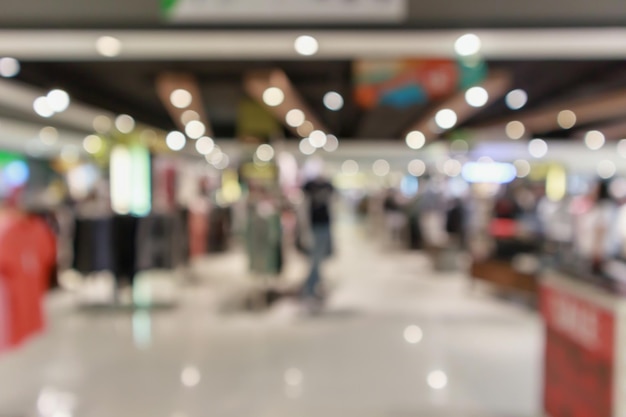
You are a GUI agent. You are given a task and a screenshot of the screen. Output one action in this format:
    pyautogui.click(x=<x>, y=<y>)
    Task: Click on the mannequin
    
    Given the screenshot: What is the action you would take?
    pyautogui.click(x=317, y=224), pyautogui.click(x=247, y=213)